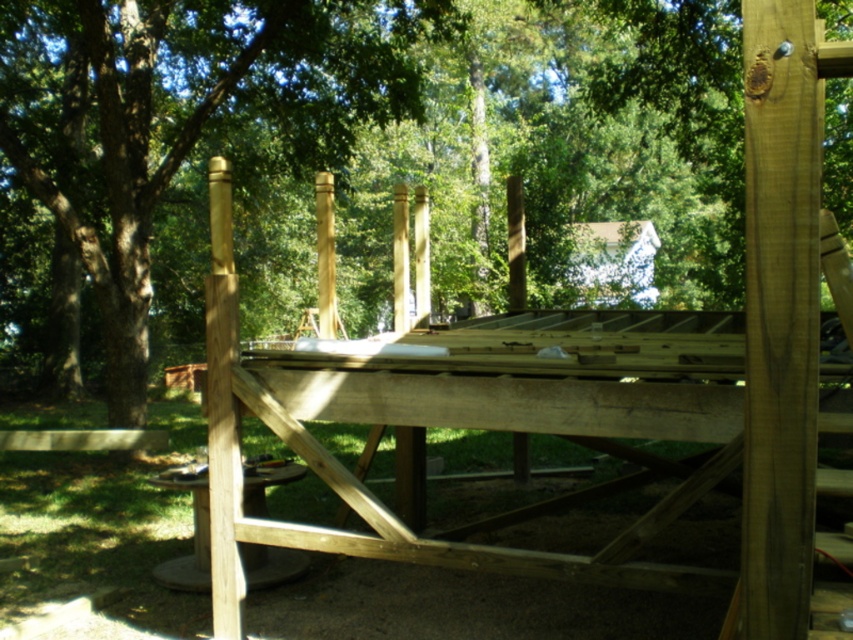
You are a construction worker planning to place a support beam exactly at the center of the wooden structure. Given the coordinates of the brown wood tree at upper center, can you determine if the beam will be placed to the left or right of the tree?

The brown wood tree at upper center is located at coordinates point (354, 147). Since the beam is to be placed at the center of the structure, which is at point (426, 320), the beam will be to the right of the brown wood tree at upper center.

You are planning to set up a picnic at the natural wood picnic table at center. Considering the position of the brown wood tree at upper center, will the tree provide shade over the picnic table during midday? Please explain your reasoning based on their positions.

The brown wood tree at upper center is above the natural wood picnic table at center, so during midday when the sun is directly overhead, the tree would cast a shadow directly over the picnic table, providing shade.

You are planning to set up a picnic and need to decide where to place your blanket. You see a brown wood tree at upper center and a natural wood picnic table at center. Which object is closer to you, the observer?

The natural wood picnic table at center is behind the brown wood tree at upper center, so the brown wood tree at upper center is closer to you.